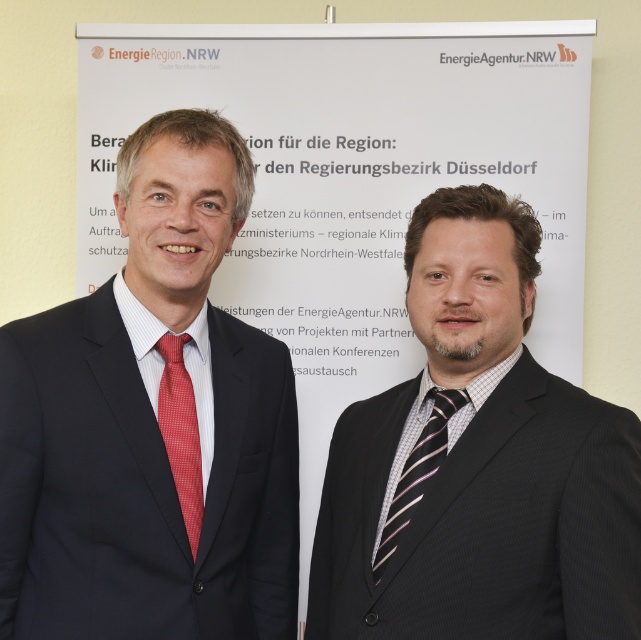
Does matte black suit at left come behind red checkered tie at left?

No, matte black suit at left is closer to the viewer.

Who is positioned more to the right, matte black suit at left or red checkered tie at left?

From the viewer's perspective, red checkered tie at left appears more on the right side.

Between point (140, 420) and point (174, 468), which one is positioned in front?

Point (140, 420)

Where is `matte black suit at left`? matte black suit at left is located at coordinates (151, 424).

Between point (185, 497) and point (408, 512), which one is positioned in front?

Point (408, 512) is more forward.

Where is `red checkered tie at left`? The height and width of the screenshot is (640, 641). red checkered tie at left is located at coordinates (179, 433).

Between point (174, 428) and point (444, 401), which one is positioned in front?

Point (174, 428)

You are a GUI agent. You are given a task and a screenshot of the screen. Output one action in this format:
    pyautogui.click(x=<x>, y=<y>)
    Task: Click on the red checkered tie at left
    
    Given the screenshot: What is the action you would take?
    pyautogui.click(x=179, y=433)

Who is positioned more to the left, matte black suit at left or striped silk tie at right?

matte black suit at left

Does matte black suit at left have a smaller size compared to striped silk tie at right?

No, matte black suit at left is not smaller than striped silk tie at right.

Which is behind, point (78, 330) or point (435, 465)?

The point (78, 330) is more distant.

At what (x,y) coordinates should I click in order to perform the action: click on matte black suit at left. Please return your answer as a coordinate pair (x, y). Image resolution: width=641 pixels, height=640 pixels. Looking at the image, I should click on (151, 424).